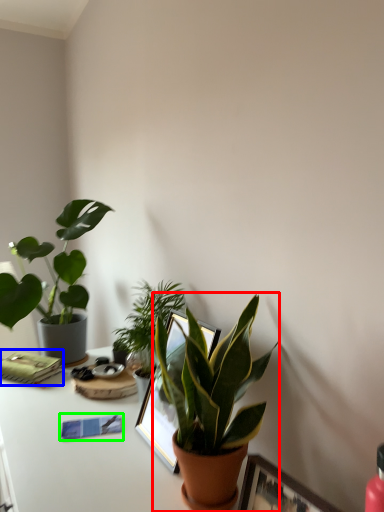
Question: Estimate the real-world distances between objects in this image. Which object is closer to houseplant (highlighted by a red box), paperback book (highlighted by a blue box) or journal (highlighted by a green box)?

Choices:
 (A) paperback book
 (B) journal

Answer: (B)